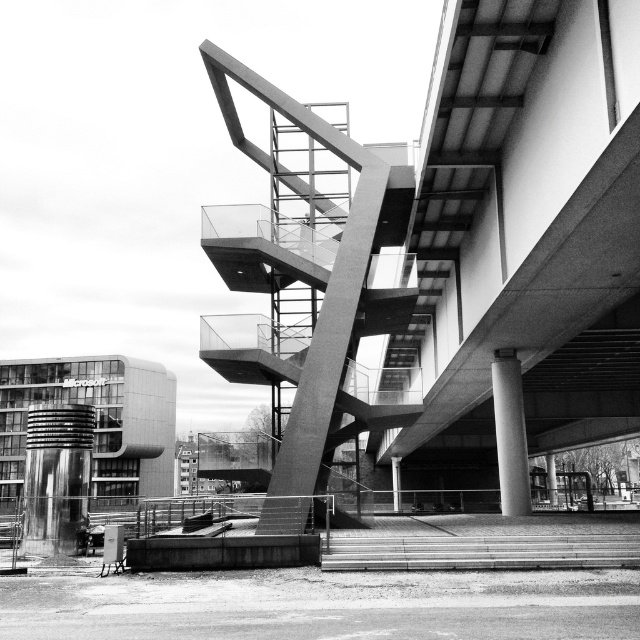
Question: Can you confirm if smooth concrete pillar at center is bigger than concrete pillar at center?

Choices:
 (A) yes
 (B) no

Answer: (A)

Question: Which point appears farthest from the camera in this image?

Choices:
 (A) (88, 490)
 (B) (396, 492)

Answer: (B)

Question: Is smooth concrete staircase at center to the right of smooth concrete column at center from the viewer's perspective?

Choices:
 (A) yes
 (B) no

Answer: (A)

Question: Which of the following is the closest to the observer?

Choices:
 (A) (632, 561)
 (B) (394, 474)
 (C) (52, 529)

Answer: (A)

Question: Which object appears closest to the camera in this image?

Choices:
 (A) smooth concrete staircase at center
 (B) polished metal cylinder at left

Answer: (A)

Question: Is concrete stairs at lower center to the right of smooth concrete column at center from the viewer's perspective?

Choices:
 (A) yes
 (B) no

Answer: (B)